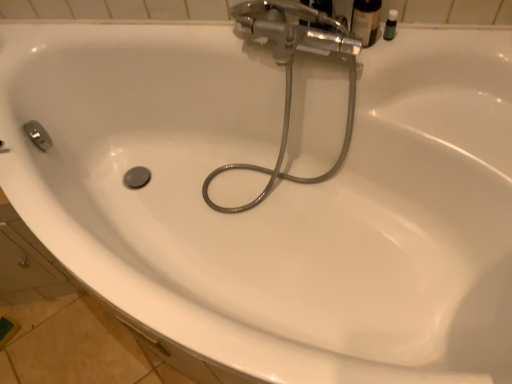
Where is `green matte bottle at upper right, which appears as the 1th toiletry when viewed from the right`? This screenshot has height=384, width=512. green matte bottle at upper right, which appears as the 1th toiletry when viewed from the right is located at coordinates (390, 25).

Does green matte bottle at upper right, which appears as the 1th toiletry when viewed from the right, have a lesser height compared to metallic hose at center?

Yes.

How much distance is there between green matte bottle at upper right, the second toiletry when ordered from left to right, and metallic hose at center?

green matte bottle at upper right, the second toiletry when ordered from left to right, is 11.62 inches away from metallic hose at center.

Is green matte bottle at upper right, the second toiletry when ordered from left to right, turned away from metallic hose at center?

No, metallic hose at center is not at the back of green matte bottle at upper right, the second toiletry when ordered from left to right.

From the image's perspective, which object appears higher, green matte bottle at upper right, the second toiletry when ordered from left to right, or metallic hose at center?

green matte bottle at upper right, the second toiletry when ordered from left to right.

In the scene shown: From a real-world perspective, is green matte bottle at upper right, which appears as the 1th toiletry when viewed from the right, below matte black bottle at upper right, the first toiletry from the left?

Correct, in the physical world, green matte bottle at upper right, which appears as the 1th toiletry when viewed from the right, is lower than matte black bottle at upper right, the first toiletry from the left.

Does green matte bottle at upper right, which appears as the 1th toiletry when viewed from the right, turn towards matte black bottle at upper right, the second toiletry from the right?

No, green matte bottle at upper right, which appears as the 1th toiletry when viewed from the right, is not oriented towards matte black bottle at upper right, the second toiletry from the right.

Is green matte bottle at upper right, the second toiletry when ordered from left to right, to the left or to the right of matte black bottle at upper right, the first toiletry from the left, in the image?

green matte bottle at upper right, the second toiletry when ordered from left to right, is to the right of matte black bottle at upper right, the first toiletry from the left.

Can you see green matte bottle at upper right, the second toiletry when ordered from left to right, touching matte black bottle at upper right, the second toiletry from the right?

Yes, green matte bottle at upper right, the second toiletry when ordered from left to right, is right next to matte black bottle at upper right, the second toiletry from the right, and making contact.

Consider the image. Is green matte bottle at upper right, the second toiletry when ordered from left to right, completely or partially inside metallic hose at center?

No.

How far apart are metallic hose at center and green matte bottle at upper right, which appears as the 1th toiletry when viewed from the right?

The distance of metallic hose at center from green matte bottle at upper right, which appears as the 1th toiletry when viewed from the right, is 11.62 inches.

Is metallic hose at center further to the viewer compared to green matte bottle at upper right, which appears as the 1th toiletry when viewed from the right?

No, metallic hose at center is closer to the viewer.

Considering the relative sizes of metallic hose at center and green matte bottle at upper right, which appears as the 1th toiletry when viewed from the right, in the image provided, is metallic hose at center smaller than green matte bottle at upper right, which appears as the 1th toiletry when viewed from the right,?

No, metallic hose at center is not smaller than green matte bottle at upper right, which appears as the 1th toiletry when viewed from the right.

Is matte black bottle at upper right, the first toiletry from the left, facing towards green matte bottle at upper right, the second toiletry when ordered from left to right?

No, matte black bottle at upper right, the first toiletry from the left, is not turned towards green matte bottle at upper right, the second toiletry when ordered from left to right.

The image size is (512, 384). Find the location of `toiletry below the matte black bottle at upper right, the second toiletry from the right (from a real-world perspective)`. toiletry below the matte black bottle at upper right, the second toiletry from the right (from a real-world perspective) is located at coordinates (390, 25).

In the scene shown: From a real-world perspective, is matte black bottle at upper right, the first toiletry from the left, under green matte bottle at upper right, which appears as the 1th toiletry when viewed from the right?

No, from a real-world perspective, matte black bottle at upper right, the first toiletry from the left, is not below green matte bottle at upper right, which appears as the 1th toiletry when viewed from the right.

Does matte black bottle at upper right, the second toiletry from the right, have a lesser height compared to green matte bottle at upper right, the second toiletry when ordered from left to right?

No, matte black bottle at upper right, the second toiletry from the right, is not shorter than green matte bottle at upper right, the second toiletry when ordered from left to right.

In the scene shown: Is metallic hose at center a part of matte black bottle at upper right, the first toiletry from the left?

No, metallic hose at center is not inside matte black bottle at upper right, the first toiletry from the left.

How different are the orientations of matte black bottle at upper right, the first toiletry from the left, and metallic hose at center in degrees?

The facing directions of matte black bottle at upper right, the first toiletry from the left, and metallic hose at center are 5.01 degrees apart.

Which object is thinner, matte black bottle at upper right, the first toiletry from the left, or metallic hose at center?

matte black bottle at upper right, the first toiletry from the left.

Where is `the 1st toiletry to the right of the metallic hose at center, starting your count from the anchor`? This screenshot has width=512, height=384. the 1st toiletry to the right of the metallic hose at center, starting your count from the anchor is located at coordinates (366, 20).

From a real-world perspective, which object stands above the other?

In real-world perspective, matte black bottle at upper right, the second toiletry from the right, is above.

Is the depth of metallic hose at center less than that of matte black bottle at upper right, the second toiletry from the right?

Yes, metallic hose at center is closer to the viewer.

Measure the distance between metallic hose at center and matte black bottle at upper right, the second toiletry from the right.

metallic hose at center and matte black bottle at upper right, the second toiletry from the right, are 8.67 inches apart from each other.

Which is more to the left, metallic hose at center or matte black bottle at upper right, the second toiletry from the right?

Positioned to the left is metallic hose at center.

The height and width of the screenshot is (384, 512). What are the coordinates of `toiletry that is the 1st object above the metallic hose at center (from a real-world perspective)` in the screenshot? It's located at (390, 25).

The height and width of the screenshot is (384, 512). Identify the location of toiletry above the green matte bottle at upper right, the second toiletry when ordered from left to right (from the image's perspective). (366, 20).

Based on their spatial positions, is matte black bottle at upper right, the first toiletry from the left, or metallic hose at center closer to green matte bottle at upper right, which appears as the 1th toiletry when viewed from the right?

matte black bottle at upper right, the first toiletry from the left, is positioned closer to the anchor green matte bottle at upper right, which appears as the 1th toiletry when viewed from the right.

Looking at the image, which one is located closer to metallic hose at center, matte black bottle at upper right, the first toiletry from the left, or green matte bottle at upper right, the second toiletry when ordered from left to right?

matte black bottle at upper right, the first toiletry from the left, is positioned closer to the anchor metallic hose at center.

From the image, which object appears to be farther from matte black bottle at upper right, the second toiletry from the right, metallic hose at center or green matte bottle at upper right, the second toiletry when ordered from left to right?

Based on the image, metallic hose at center appears to be further to matte black bottle at upper right, the second toiletry from the right.

When comparing their distances from matte black bottle at upper right, the second toiletry from the right, does green matte bottle at upper right, the second toiletry when ordered from left to right, or metallic hose at center seem closer?

Among the two, green matte bottle at upper right, the second toiletry when ordered from left to right, is located nearer to matte black bottle at upper right, the second toiletry from the right.

Which object lies nearer to the anchor point metallic hose at center, green matte bottle at upper right, the second toiletry when ordered from left to right, or matte black bottle at upper right, the first toiletry from the left?

matte black bottle at upper right, the first toiletry from the left, lies closer to metallic hose at center than the other object.

When comparing their distances from green matte bottle at upper right, which appears as the 1th toiletry when viewed from the right, does metallic hose at center or matte black bottle at upper right, the second toiletry from the right, seem further?

The object further to green matte bottle at upper right, which appears as the 1th toiletry when viewed from the right, is metallic hose at center.

I want to click on toiletry between metallic hose at center and green matte bottle at upper right, which appears as the 1th toiletry when viewed from the right, so click(x=366, y=20).